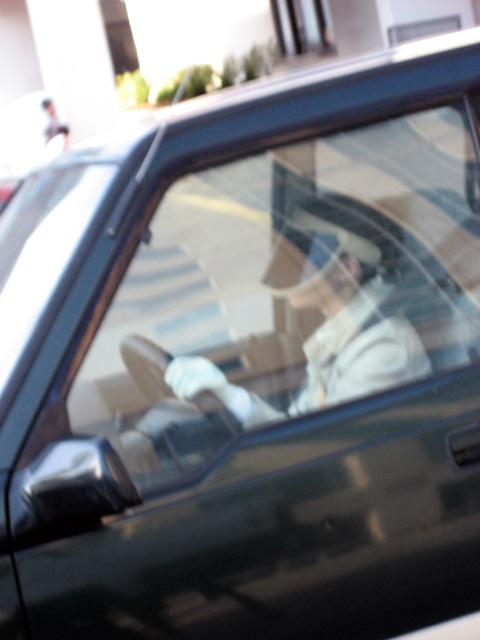
Question: Which point is closer to the camera?

Choices:
 (A) 332,45
 (B) 340,387

Answer: (B)

Question: From the image, what is the correct spatial relationship of white matte jacket at center in relation to transparent glass window at upper center?

Choices:
 (A) left
 (B) right

Answer: (A)

Question: Which point is closer to the camera?

Choices:
 (A) (291, 0)
 (B) (369, 273)

Answer: (B)

Question: Can you confirm if white matte jacket at center is positioned below transparent glass window at upper center?

Choices:
 (A) no
 (B) yes

Answer: (B)

Question: Is white matte jacket at center above transparent glass window at upper center?

Choices:
 (A) yes
 (B) no

Answer: (B)

Question: Which point is closer to the camera?

Choices:
 (A) transparent glass window at upper center
 (B) white matte jacket at center

Answer: (B)